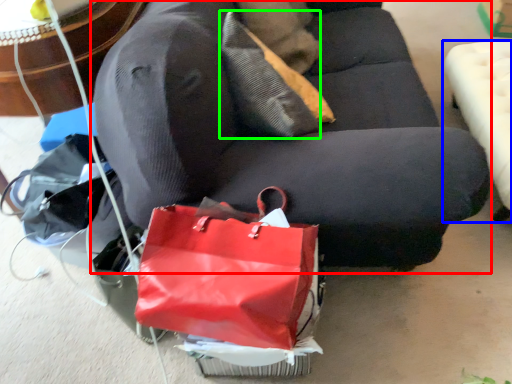
Question: Which is farther away from studio couch (highlighted by a red box)? furniture (highlighted by a blue box) or pillow (highlighted by a green box)?

Choices:
 (A) furniture
 (B) pillow

Answer: (A)